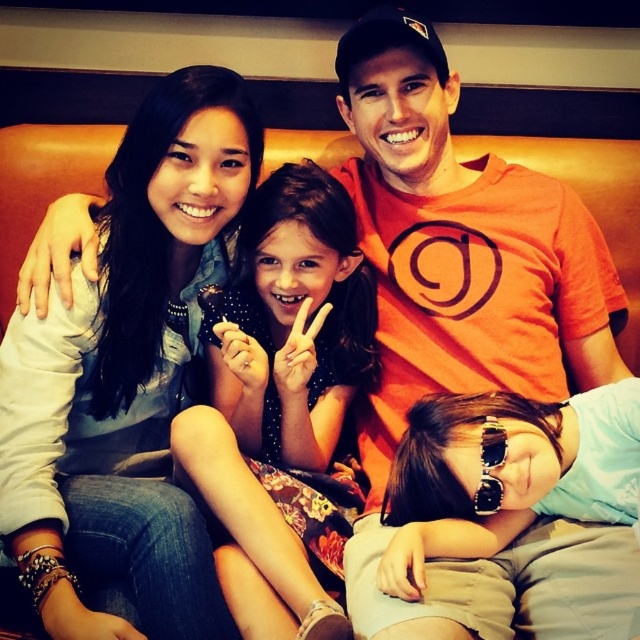
What do you see at coordinates (125, 381) in the screenshot? This screenshot has width=640, height=640. I see `matte blue scarf at upper left` at bounding box center [125, 381].

Measure the distance between matte blue scarf at upper left and camera.

A distance of 36.90 inches exists between matte blue scarf at upper left and camera.

What do you see at coordinates (125, 381) in the screenshot?
I see `matte blue scarf at upper left` at bounding box center [125, 381].

The width and height of the screenshot is (640, 640). In order to click on matte blue scarf at upper left in this screenshot , I will do click(125, 381).

Is matte blue scarf at upper left above sunglasses at center?

Yes.

At what (x,y) coordinates should I click in order to perform the action: click on matte blue scarf at upper left. Please return your answer as a coordinate pair (x, y). The height and width of the screenshot is (640, 640). Looking at the image, I should click on (125, 381).

In the scene shown: Who is more forward, [168,193] or [538,445]?

Positioned in front is point [538,445].

The width and height of the screenshot is (640, 640). Find the location of `matte blue scarf at upper left`. matte blue scarf at upper left is located at coordinates (125, 381).

Is point (326, 595) behind point (426, 422)?

No, (326, 595) is closer to viewer.

Describe the element at coordinates (284, 381) in the screenshot. I see `floral dress at center` at that location.

This screenshot has height=640, width=640. What do you see at coordinates (284, 381) in the screenshot?
I see `floral dress at center` at bounding box center [284, 381].

Where is `floral dress at center`? The image size is (640, 640). floral dress at center is located at coordinates (284, 381).